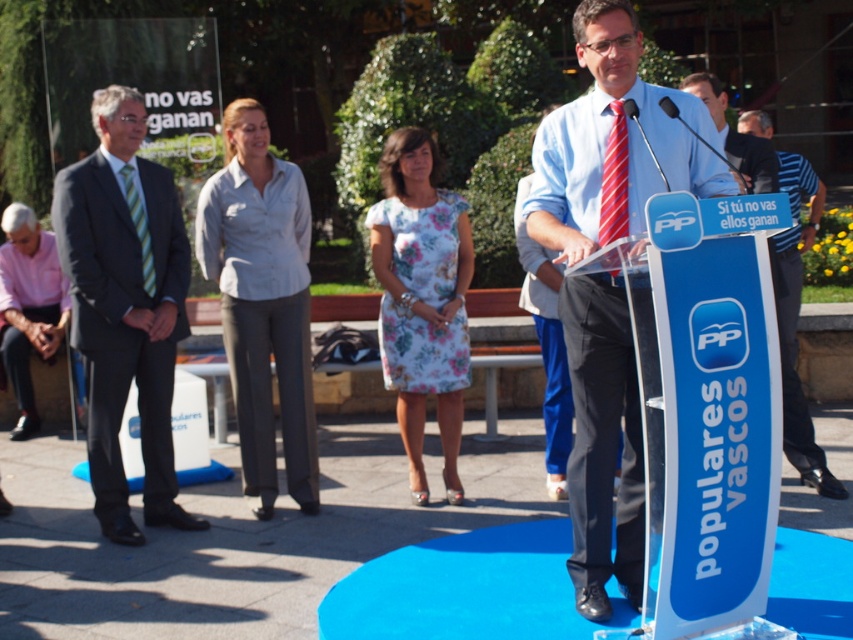
Question: Which is farther from the light blue shirt at center?

Choices:
 (A) dark gray suit at left
 (B) light blue cotton shirt at center
 (C) green striped tie at left
 (D) red striped tie at center

Answer: (D)

Question: Does striped cotton shirt at center appear on the right side of green striped tie at left?

Choices:
 (A) yes
 (B) no

Answer: (A)

Question: Can you confirm if light blue cotton shirt at center is wider than light blue shirt at center?

Choices:
 (A) yes
 (B) no

Answer: (A)

Question: Which object appears closest to the camera in this image?

Choices:
 (A) light blue shirt at center
 (B) red striped tie at center
 (C) striped cotton shirt at center
 (D) dark gray suit at left

Answer: (B)

Question: Does light blue shirt and tie at center have a smaller size compared to light blue cotton shirt at center?

Choices:
 (A) no
 (B) yes

Answer: (A)

Question: Which point is farther from the camera taking this photo?

Choices:
 (A) (93, 384)
 (B) (144, 234)

Answer: (B)